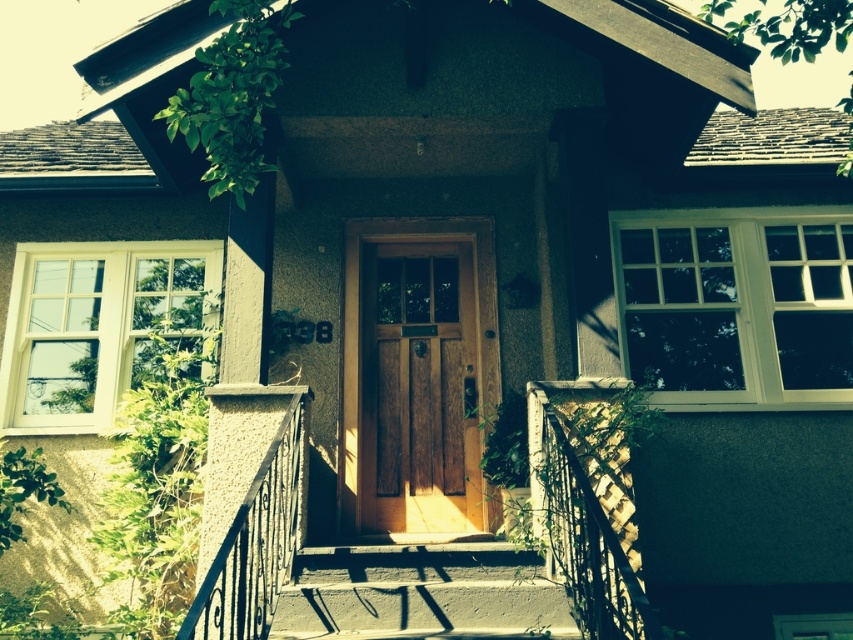
You are standing at the bottom of the steps leading to the house. You want to place a potted plant exactly at the point marked by the coordinates point (421, 593). Based on the scene description, where would this point be located?

The point (421, 593) marks the concrete steps at center, so the potted plant should be placed on the concrete steps at center.

You are a delivery person trying to deliver a package to the house. The package is too large to fit through the black wrought iron railing at center. Can you determine if the wooden door at center is wide enough to allow the package to be delivered?

The wooden door at center might be wider than black wrought iron railing at center, so there is a possibility that the wooden door at center is wide enough to allow the package to be delivered.